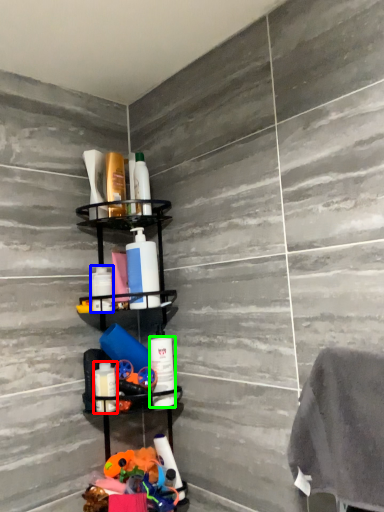
Question: Based on their relative distances, which object is farther from toiletry (highlighted by a red box)? Choose from toiletry (highlighted by a blue box) and toiletry (highlighted by a green box).

Choices:
 (A) toiletry
 (B) toiletry

Answer: (A)